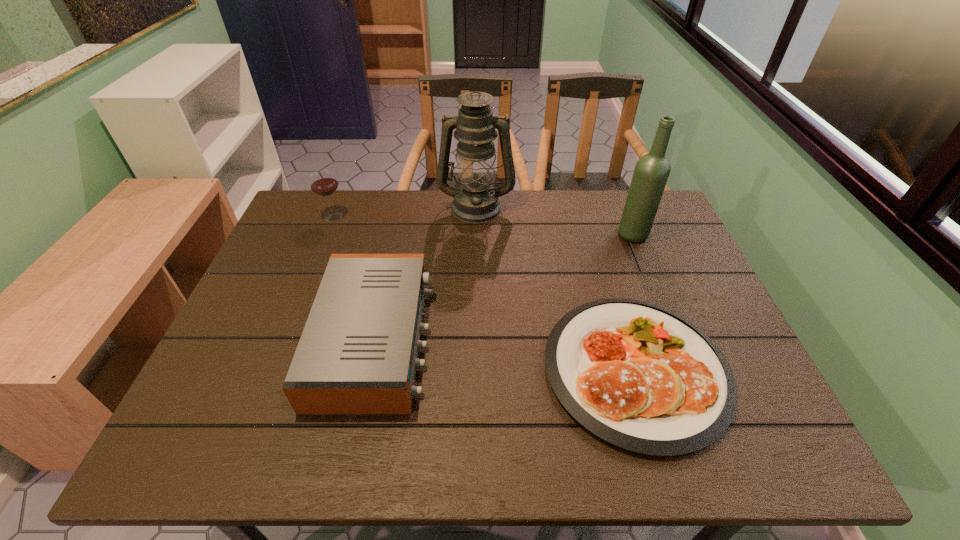
The height and width of the screenshot is (540, 960). I want to click on object positioned at the near right corner, so click(x=637, y=375).

The height and width of the screenshot is (540, 960). In the image, there is a desktop. What are the coordinates of `blank space at the far edge` in the screenshot? It's located at (568, 229).

I want to click on vacant space at the near edge of the desktop, so click(585, 459).

Find the location of `free location at the left edge`. free location at the left edge is located at coordinates (276, 350).

In the image, there is a desktop. Where is `free space at the far left corner`? The height and width of the screenshot is (540, 960). free space at the far left corner is located at coordinates (328, 226).

Identify the location of free space between the shortest object and the oil lamp. (556, 288).

Locate an element on the screen. This screenshot has width=960, height=540. empty space that is in between the third shortest object and the oil lamp is located at coordinates (405, 212).

Locate an element on the screen. The height and width of the screenshot is (540, 960). free point between the oil lamp and the dish is located at coordinates (556, 288).

Locate an element on the screen. free spot between the oil lamp and the shortest object is located at coordinates (556, 288).

Locate an element on the screen. The image size is (960, 540). vacant space in between the second shortest object and the wine bottle is located at coordinates (504, 286).